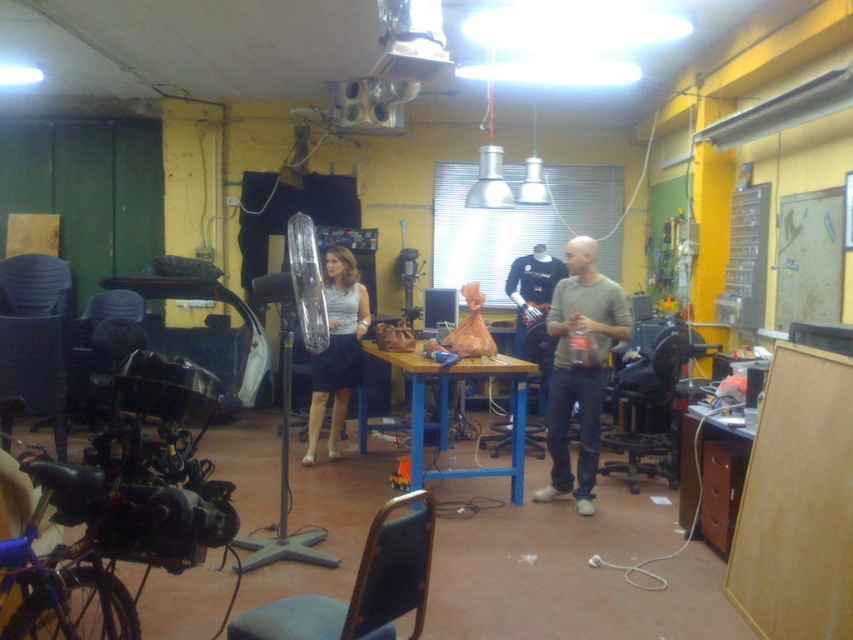
You are standing in the workshop and need to locate the gray cotton shirt at center. According to the coordinates provided, where exactly is it positioned in the image?

The gray cotton shirt at center is located at point 0.575 on the x axis and 0.681 on the y axis.

You are standing in the workshop and need to move from the wooden table at center to the matte gray skirt at center. Which direction should you move?

The wooden table at center is to the right of the matte gray skirt at center, so you should move to the left to reach it.

You are standing at the point with coordinates point [691,420] in the workshop. You want to walk towards the point with coordinates point [497,355]. Will you have to go around any obstacles between these two points?

Point [497,355] is behind point [691,420], so you will have to go around the obstacle in front of you to reach the desired point.